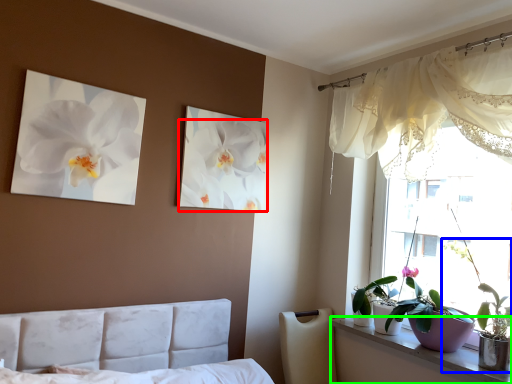
Question: Estimate the real-world distances between objects in this image. Which object is farther from flower (highlighted by a red box), houseplant (highlighted by a blue box) or window sill (highlighted by a green box)?

Choices:
 (A) houseplant
 (B) window sill

Answer: (A)